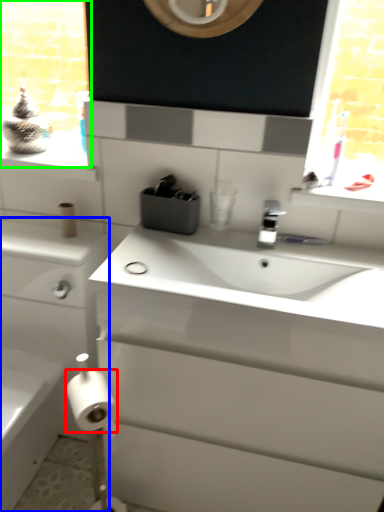
Question: Which object is positioned closest to toilet paper (highlighted by a red box)? Select from bathroom cabinet (highlighted by a blue box) and window frame (highlighted by a green box).

Choices:
 (A) bathroom cabinet
 (B) window frame

Answer: (A)